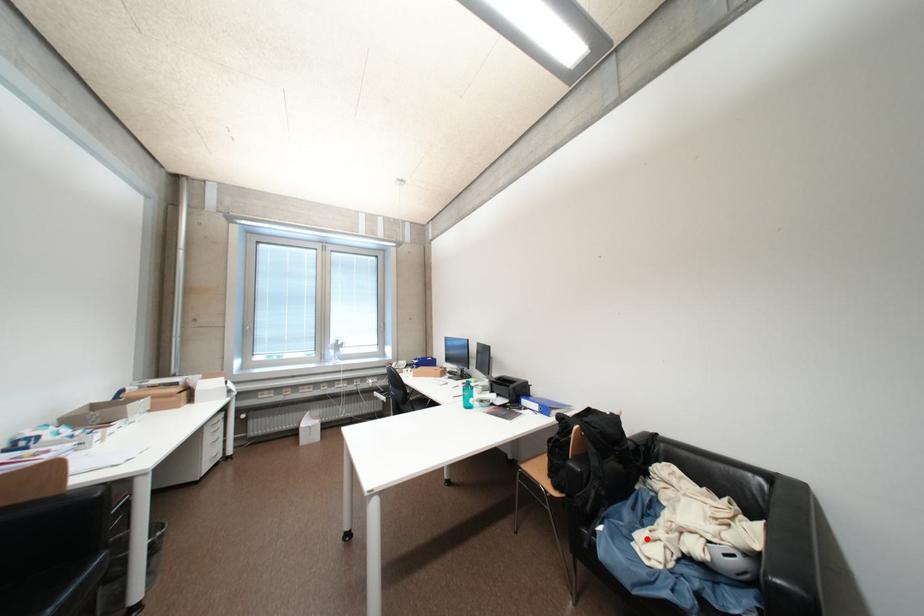
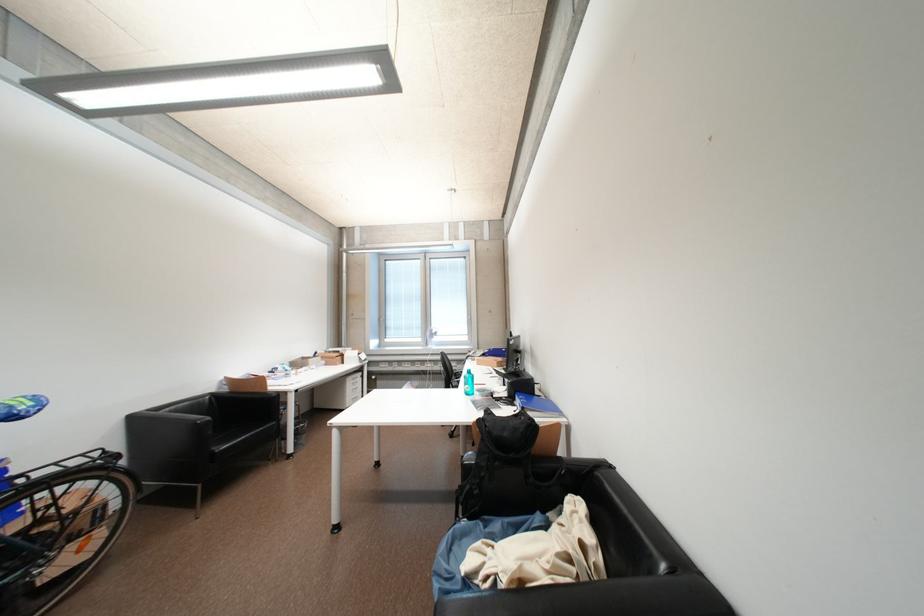
Where in the second image is the point corresponding to the highlighted location from the first image?

(487, 546)